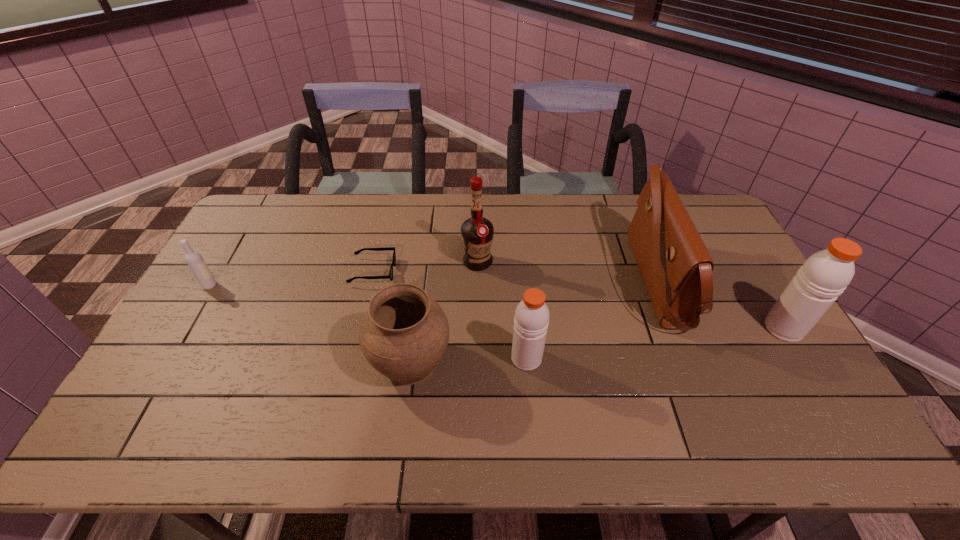
Please show where to add a shaker on the left while keeping spacing even. Please provide its 2D coordinates. Your answer should be formatted as a tuple, i.e. [(x, y)], where the tuple contains the x and y coordinates of a point satisfying the conditions above.

[(238, 392)]